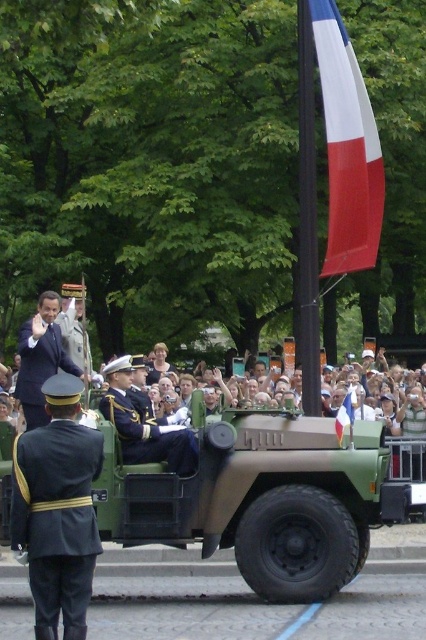
Question: Considering the real-world distances, which object is closest to the shiny blue fabric uniform at center?

Choices:
 (A) dark blue fabric uniform at left
 (B) dark blue suit at center
 (C) red fabric flag at center

Answer: (B)

Question: From the image, what is the correct spatial relationship of dark blue fabric uniform at left in relation to dark blue suit at center?

Choices:
 (A) left
 (B) right

Answer: (B)

Question: Can you confirm if shiny blue fabric uniform at center is positioned to the right of red fabric flag at center?

Choices:
 (A) yes
 (B) no

Answer: (B)

Question: Among these points, which one is farthest from the camera?

Choices:
 (A) (89, 579)
 (B) (267, 538)
 (C) (351, 148)
 (D) (36, 330)

Answer: (C)

Question: Can you confirm if dark blue fabric uniform at left is thinner than red fabric flag at center?

Choices:
 (A) yes
 (B) no

Answer: (A)

Question: Which object appears closest to the camera in this image?

Choices:
 (A) dark blue suit at center
 (B) dark blue fabric uniform at left

Answer: (B)